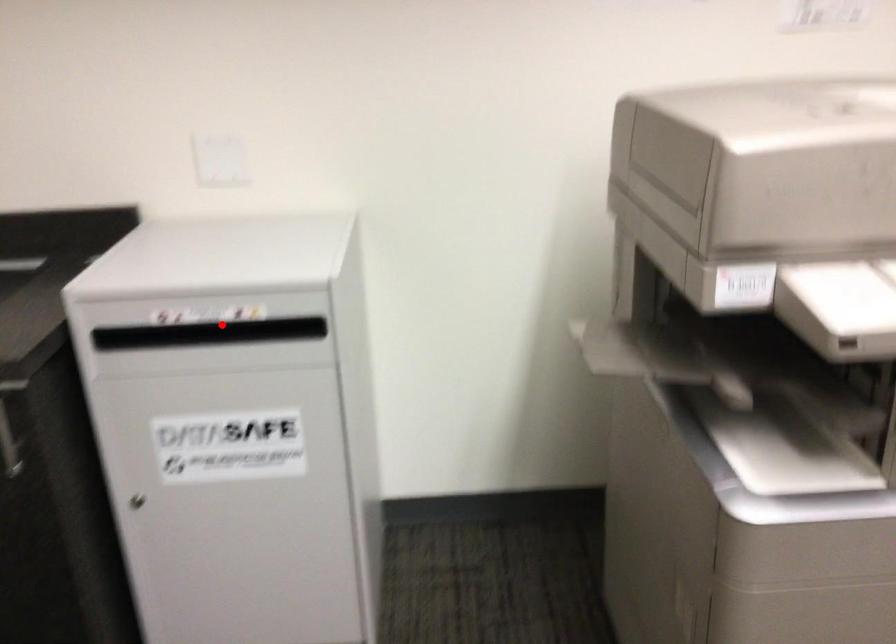
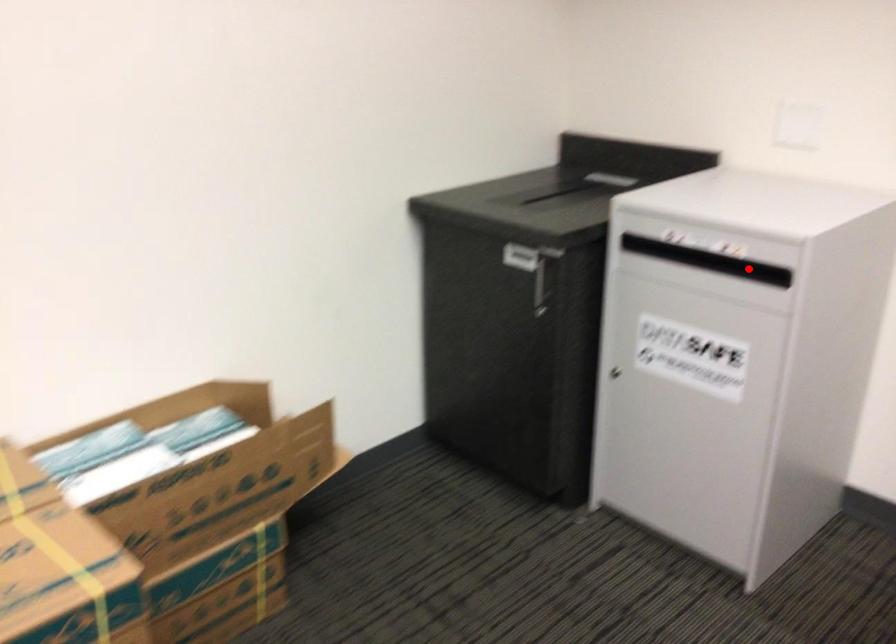
I am providing you with two images of the same scene from different viewpoints. A red point is marked on the first image and another point is marked on the second image. Do the highlighted points in image1 and image2 indicate the same real-world spot?

Yes